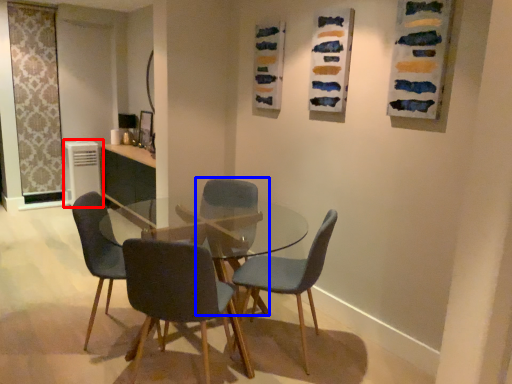
Question: Which point is further to the camera, appliance (highlighted by a red box) or chair (highlighted by a blue box)?

Choices:
 (A) appliance
 (B) chair

Answer: (A)